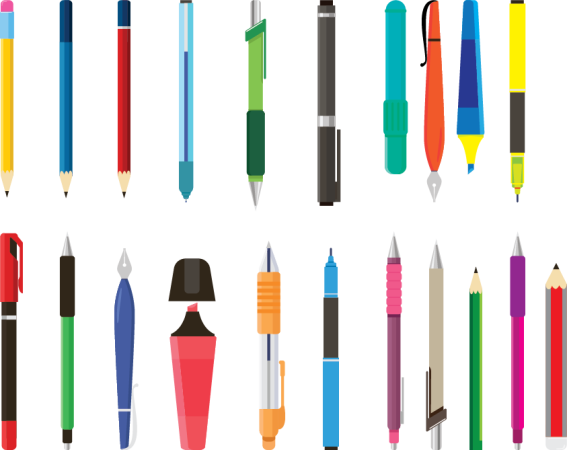
Image resolution: width=567 pixels, height=450 pixels. What are the coordinates of `pen clips` in the screenshot? It's located at (19, 244), (134, 429), (281, 398), (403, 413), (425, 405), (422, 18), (263, 43), (338, 166).